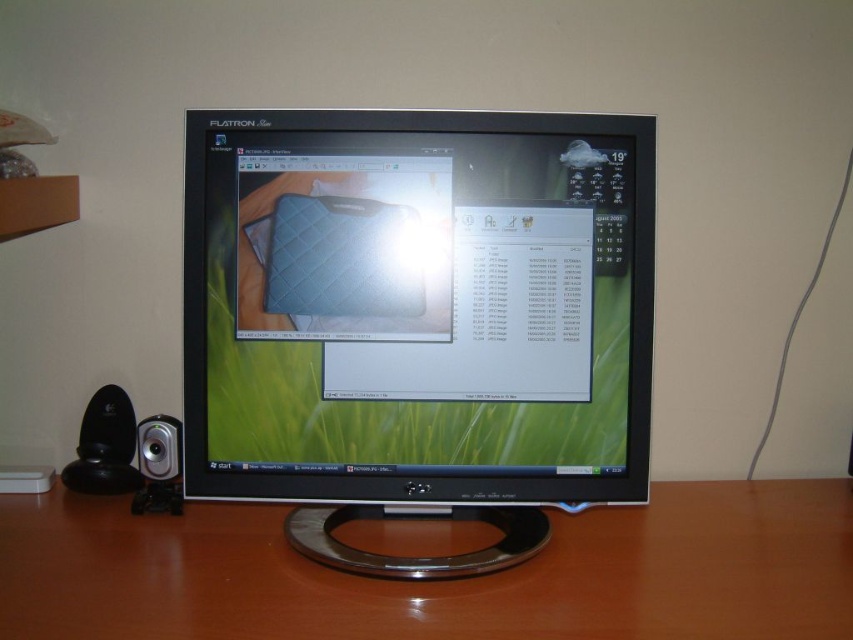
Question: Which of the following is the farthest from the observer?

Choices:
 (A) (109, 438)
 (B) (527, 440)
 (C) (432, 609)
 (D) (177, 440)

Answer: (A)

Question: Does black plastic speaker at lower left have a larger size compared to silver metallic speaker at lower left?

Choices:
 (A) yes
 (B) no

Answer: (A)

Question: Which object appears farthest from the camera in this image?

Choices:
 (A) black glossy monitor at center
 (B) silver metallic speaker at lower left
 (C) black plastic speaker at lower left

Answer: (C)

Question: Estimate the real-world distances between objects in this image. Which object is farther from the black glossy monitor at center?

Choices:
 (A) black plastic speaker at lower left
 (B) brown wood computer desk at center
 (C) silver metallic speaker at lower left

Answer: (A)

Question: Does black glossy monitor at center have a smaller size compared to silver metallic speaker at lower left?

Choices:
 (A) no
 (B) yes

Answer: (A)

Question: Can you confirm if black glossy monitor at center is positioned below brown wood computer desk at center?

Choices:
 (A) yes
 (B) no

Answer: (B)